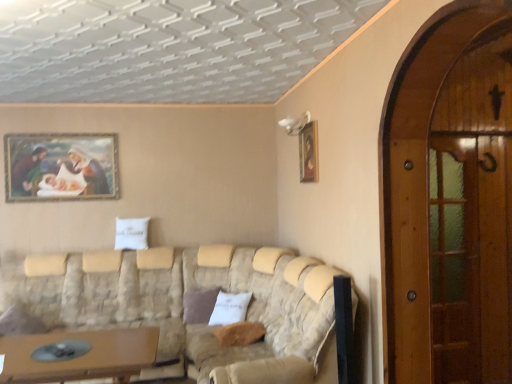
Question: Considering the positions of point (75, 157) and point (186, 309), is point (75, 157) closer or farther from the camera than point (186, 309)?

Choices:
 (A) farther
 (B) closer

Answer: (A)

Question: Based on their sizes in the image, would you say wooden framed painting at upper left, the second picture frame positioned from the front, is bigger or smaller than brown fabric pillow at center, the 1th pillow positioned from the left?

Choices:
 (A) big
 (B) small

Answer: (B)

Question: Based on their relative distances, which object is nearer to the brown fabric pillow at center, the 1th pillow positioned from the left?

Choices:
 (A) wooden screen door at right, which is counted as the first screen door, starting from the right
 (B) wooden picture frame at upper right, which appears as the 1th picture frame when viewed from the front
 (C) wooden screen door at right, which appears as the 2th screen door when viewed from the back
 (D) textured beige couch at center
 (E) brown wooden table at lower left

Answer: (D)

Question: Considering the real-world distances, which object is closest to the brown fabric pillow at center, the 1th pillow positioned from the left?

Choices:
 (A) wooden picture frame at upper right, which appears as the 1th picture frame when viewed from the front
 (B) wooden framed painting at upper left, the second picture frame positioned from the front
 (C) brown plush pillow at center, the 1th pillow positioned from the right
 (D) textured beige couch at center
 (E) beige fabric couch at lower center

Answer: (C)